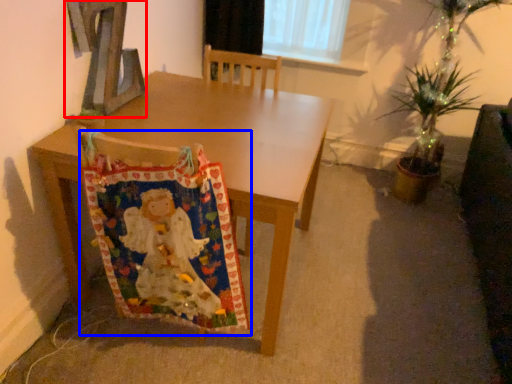
Question: Which point is further to the camera, alphabet (highlighted by a red box) or blanket (highlighted by a blue box)?

Choices:
 (A) alphabet
 (B) blanket

Answer: (A)